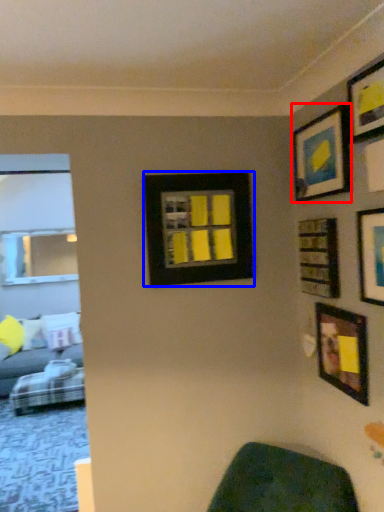
Question: Which point is further to the camera, picture frame (highlighted by a red box) or picture frame (highlighted by a blue box)?

Choices:
 (A) picture frame
 (B) picture frame

Answer: (B)